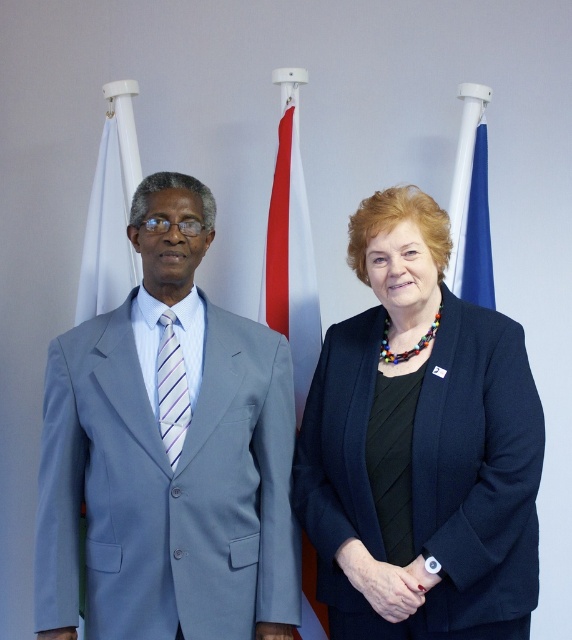
You are a photographer who needs to capture a clear shot of both the white fabric flag at left and the striped fabric tie at center. Based on their positions, which object is located to the left of the other?

The white fabric flag at left is to the left of the striped fabric tie at center.

You are a photographer standing 1.5 meters away from the black fabric jacket at center. Can you reach out and touch it without moving your position?

The black fabric jacket at center is 1.80 meters away from the viewer. Since you are standing 1.5 meters away from it, you can reach out and touch it without moving your position because you are closer than the jacket.

You are a photographer setting up for a group photo. You need to position the light blue suit at left and the black fabric jacket at center so that they are aligned horizontally. Based on their current positions, which adjustment should you make?

The light blue suit at left is currently above the black fabric jacket at center, so to align them horizontally, you should move the light blue suit at left downward or the black fabric jacket at center upward.